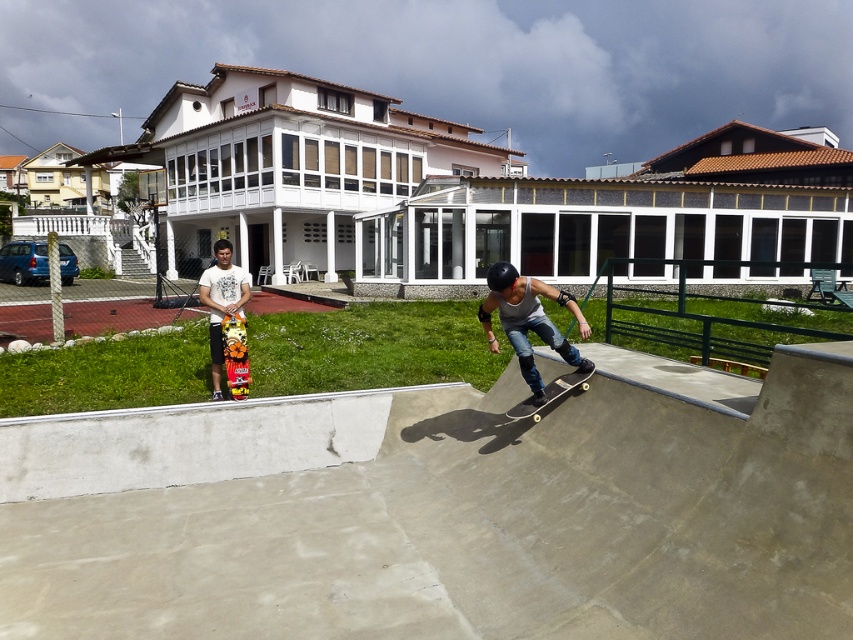
You are a photographer positioned at the skatepark. You need to capture a photo of the concrete ramp at center and the matte gray tank top at center. Which object should you focus on first if you want to ensure both are in sharp focus?

The concrete ramp at center is wider than the matte gray tank top at center, so focusing on the wider object first will help ensure both are in focus.

You are standing at the entrance of the skatepark and want to locate the concrete ramp at center. According to the coordinates provided, where should you look?

You should look at point (486, 520) to find the concrete ramp at center.

You are standing at the point with coordinates point (486,520). What object are you standing on?

The point (486,520) corresponds to the concrete ramp at center.